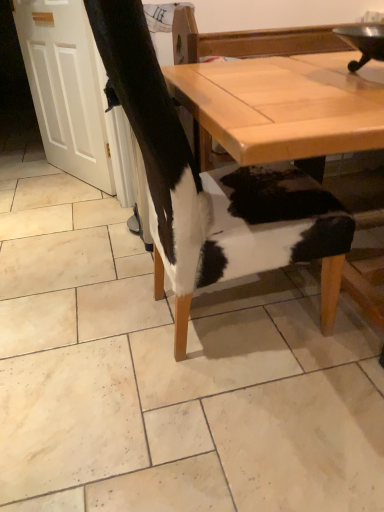
Question: Are cowhide chair at center and light brown wooden table at center located far from each other?

Choices:
 (A) yes
 (B) no

Answer: (B)

Question: From the image's perspective, would you say cowhide chair at center is shown under light brown wooden table at center?

Choices:
 (A) no
 (B) yes

Answer: (B)

Question: From a real-world perspective, does cowhide chair at center sit lower than light brown wooden table at center?

Choices:
 (A) yes
 (B) no

Answer: (A)

Question: Is cowhide chair at center wider than light brown wooden table at center?

Choices:
 (A) no
 (B) yes

Answer: (B)

Question: Is cowhide chair at center surrounding light brown wooden table at center?

Choices:
 (A) yes
 (B) no

Answer: (B)

Question: Does cowhide chair at center lie behind light brown wooden table at center?

Choices:
 (A) yes
 (B) no

Answer: (B)

Question: Is cowhide at center oriented towards cowhide chair at center?

Choices:
 (A) no
 (B) yes

Answer: (A)

Question: Is cowhide at center positioned far away from cowhide chair at center?

Choices:
 (A) yes
 (B) no

Answer: (B)

Question: From the image's perspective, is cowhide at center below cowhide chair at center?

Choices:
 (A) no
 (B) yes

Answer: (A)

Question: Is cowhide at center closer to camera compared to cowhide chair at center?

Choices:
 (A) yes
 (B) no

Answer: (B)

Question: Is cowhide at center turned away from cowhide chair at center?

Choices:
 (A) no
 (B) yes

Answer: (A)

Question: Is cowhide at center directly adjacent to cowhide chair at center?

Choices:
 (A) no
 (B) yes

Answer: (B)

Question: Can you confirm if cowhide chair at center is smaller than cowhide chair at center?

Choices:
 (A) no
 (B) yes

Answer: (A)